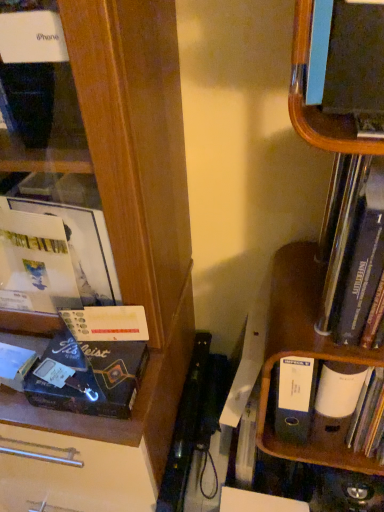
Question: Does matte black bookshelf at upper right, which is the second shelf in bottom-to-top order, appear on the left side of black cardboard book at left?

Choices:
 (A) no
 (B) yes

Answer: (A)

Question: Does matte black bookshelf at upper right, which is counted as the 1th shelf, starting from the top, appear on the right side of black cardboard book at left?

Choices:
 (A) no
 (B) yes

Answer: (B)

Question: Does matte black bookshelf at upper right, which is the second shelf in bottom-to-top order, have a smaller size compared to black cardboard book at left?

Choices:
 (A) no
 (B) yes

Answer: (A)

Question: Does matte black bookshelf at upper right, which is counted as the 1th shelf, starting from the top, turn towards black cardboard book at left?

Choices:
 (A) no
 (B) yes

Answer: (A)

Question: Considering the relative positions of matte black bookshelf at upper right, which is counted as the 1th shelf, starting from the top, and black cardboard book at left in the image provided, is matte black bookshelf at upper right, which is counted as the 1th shelf, starting from the top, behind black cardboard book at left?

Choices:
 (A) no
 (B) yes

Answer: (A)

Question: Is point (344, 281) positioned closer to the camera than point (301, 72)?

Choices:
 (A) farther
 (B) closer

Answer: (A)

Question: In terms of height, does hardcover book at right look taller or shorter compared to wooden bookshelf at right, the 1th shelf when ordered from bottom to top?

Choices:
 (A) tall
 (B) short

Answer: (B)

Question: In terms of width, does hardcover book at right look wider or thinner when compared to wooden bookshelf at right, the 1th shelf when ordered from bottom to top?

Choices:
 (A) thin
 (B) wide

Answer: (A)

Question: From a real-world perspective, is hardcover book at right physically located above or below wooden bookshelf at right, acting as the second shelf starting from the top?

Choices:
 (A) above
 (B) below

Answer: (A)

Question: Is blue cardboard file at lower right wider or thinner than black cardboard book at left?

Choices:
 (A) thin
 (B) wide

Answer: (B)

Question: Is blue cardboard file at lower right inside the boundaries of black cardboard book at left, or outside?

Choices:
 (A) outside
 (B) inside

Answer: (A)

Question: Would you say blue cardboard file at lower right is to the left or to the right of black cardboard book at left in the picture?

Choices:
 (A) right
 (B) left

Answer: (A)

Question: From a real-world perspective, is blue cardboard file at lower right physically located above or below black cardboard book at left?

Choices:
 (A) above
 (B) below

Answer: (B)

Question: From the image's perspective, relative to blue cardboard file at lower right, is hardcover book at right above or below?

Choices:
 (A) above
 (B) below

Answer: (A)

Question: Is hardcover book at right taller or shorter than blue cardboard file at lower right?

Choices:
 (A) short
 (B) tall

Answer: (B)